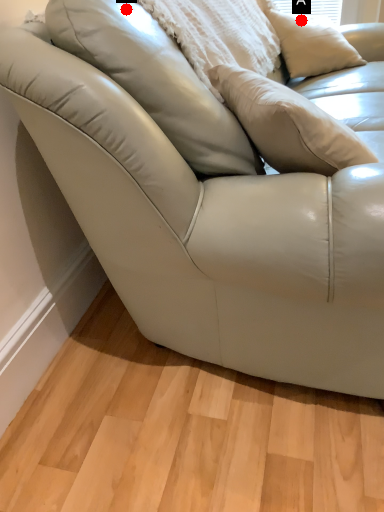
Question: Two points are circled on the image, labeled by A and B beside each circle. Which point is farther to the camera?

Choices:
 (A) A is further
 (B) B is further

Answer: (A)